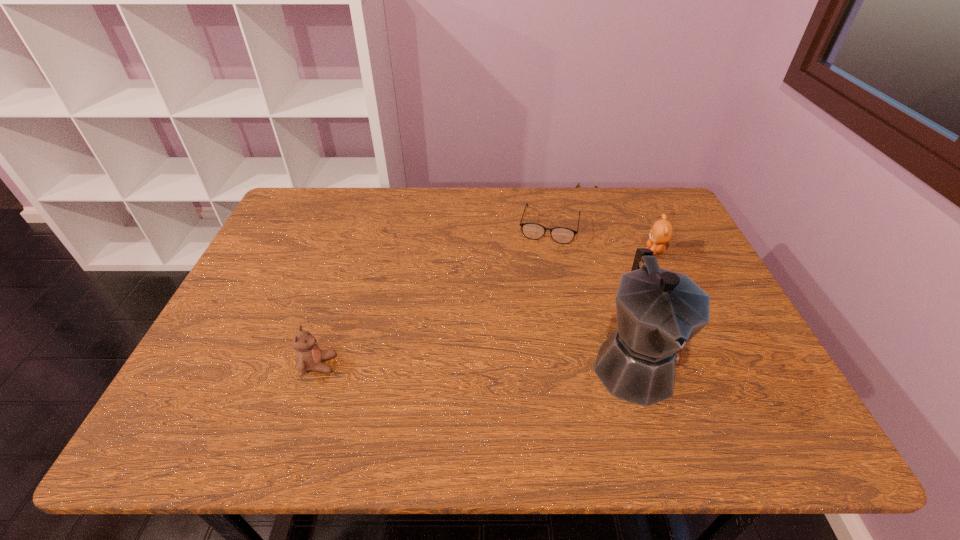
Image resolution: width=960 pixels, height=540 pixels. I want to click on free space located on the face of the rightmost object, so click(593, 291).

Find the location of a particular element. The width and height of the screenshot is (960, 540). vacant region located on the face of the rightmost object is located at coordinates tap(560, 311).

The height and width of the screenshot is (540, 960). What are the coordinates of `vacant space located 0.100m on the face of the rightmost object` in the screenshot? It's located at (625, 271).

Locate an element on the screen. object located at the far edge is located at coordinates (562, 235).

You are a GUI agent. You are given a task and a screenshot of the screen. Output one action in this format:
    pyautogui.click(x=<x>, y=<y>)
    Task: Click on the teddy bear located at the near edge
    The image size is (960, 540).
    Given the screenshot: What is the action you would take?
    pyautogui.click(x=309, y=357)

I want to click on coffeepot at the near edge, so click(659, 311).

This screenshot has height=540, width=960. Identify the location of object at the right edge. (661, 232).

Identify the location of vacant space at the far edge of the desktop. (485, 218).

At what (x,y) coordinates should I click in order to perform the action: click on vacant space at the near edge of the desktop. Please return your answer as a coordinate pair (x, y). This screenshot has width=960, height=540. Looking at the image, I should click on (379, 370).

What are the coordinates of `free space at the left edge of the desktop` in the screenshot? It's located at (274, 241).